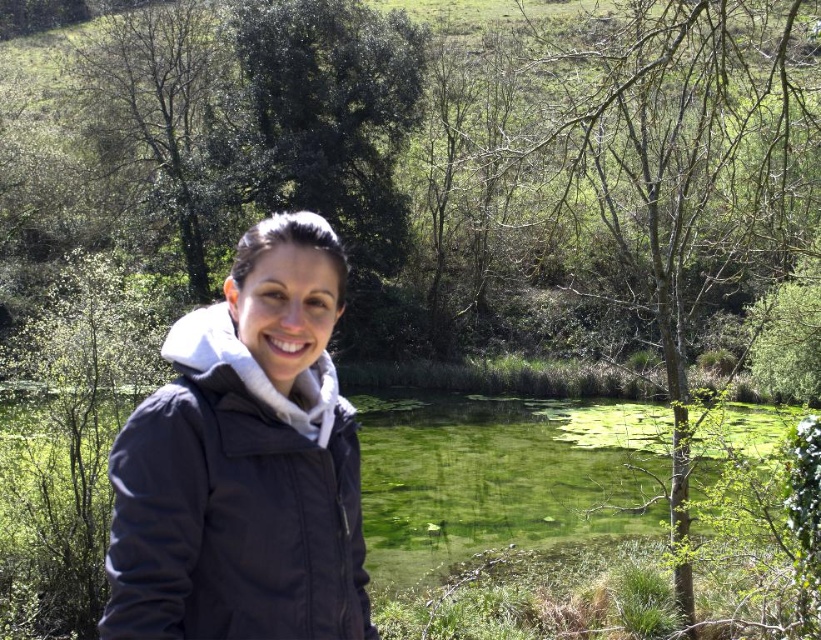
Can you confirm if green leafy tree at upper center is taller than green leafy tree at upper left?

Correct, green leafy tree at upper center is much taller as green leafy tree at upper left.

Is green leafy tree at upper center closer to the viewer compared to green leafy tree at upper left?

Yes.

Find the location of a particular element. green leafy tree at upper center is located at coordinates (690, 179).

Can you confirm if green leafy tree at upper center is positioned above navy blue jacket at center?

Yes.

Can you confirm if green leafy tree at upper center is positioned to the right of navy blue jacket at center?

Correct, you'll find green leafy tree at upper center to the right of navy blue jacket at center.

At what (x,y) coordinates should I click in order to perform the action: click on green leafy tree at upper center. Please return your answer as a coordinate pair (x, y). Looking at the image, I should click on (690, 179).

Which is in front, point (204, 413) or point (113, 125)?

Point (204, 413) is in front.

Which is more to the left, navy blue jacket at center or green leafy tree at upper left?

green leafy tree at upper left is more to the left.

Is point (225, 476) farther from viewer compared to point (71, 93)?

No, it is in front of (71, 93).

I want to click on navy blue jacket at center, so click(x=235, y=500).